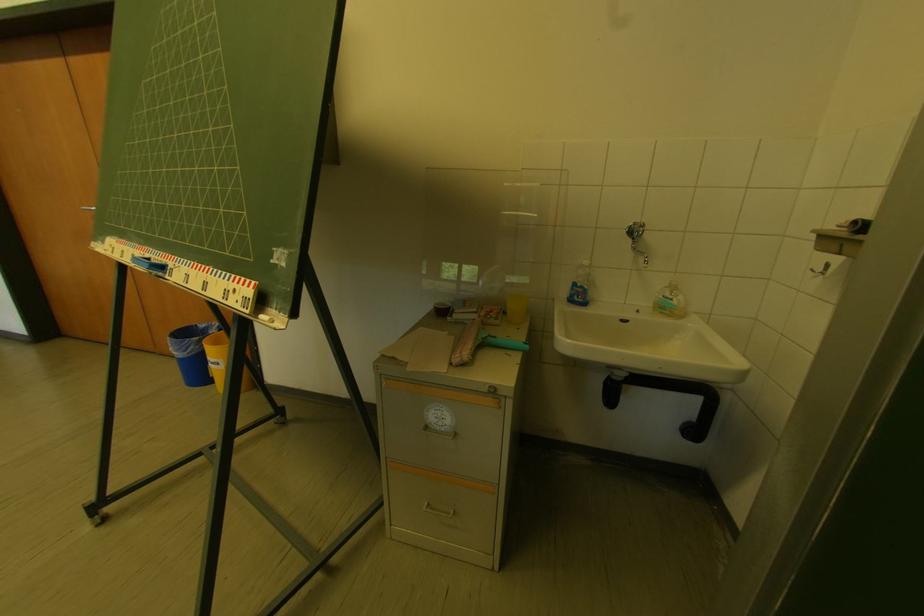
Image resolution: width=924 pixels, height=616 pixels. Describe the element at coordinates (220, 360) in the screenshot. I see `the yellow trash can` at that location.